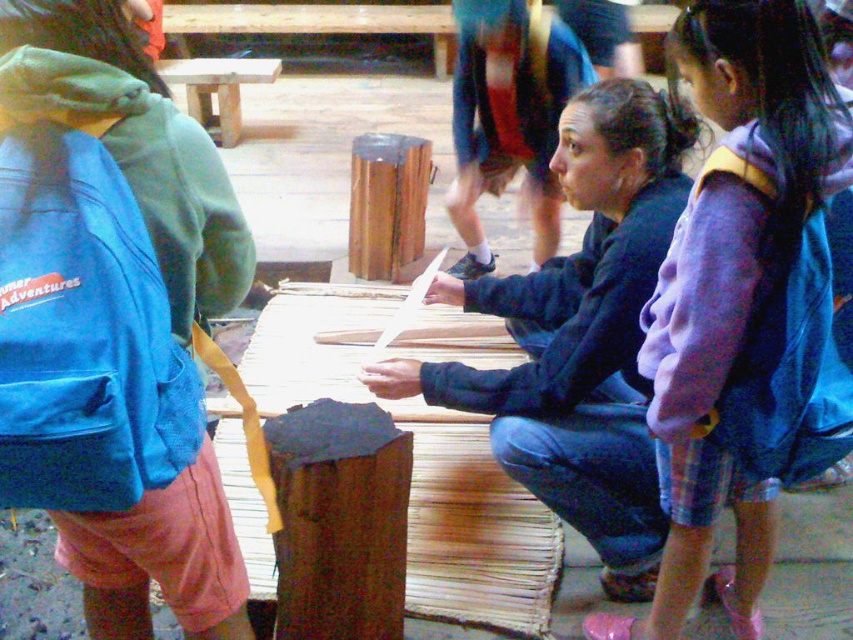
Question: Is blue fleece jacket at left wider than dark brown wood at center?

Choices:
 (A) yes
 (B) no

Answer: (A)

Question: Estimate the real-world distances between objects in this image. Which object is farther from the purple fleece jacket at center?

Choices:
 (A) smooth brown wood at center
 (B) blue fleece jacket at left
 (C) woodenmaterial/texture at center
 (D) dark blue fleece jacket at center

Answer: (A)

Question: Which object is positioned closest to the dark blue fleece jacket at center?

Choices:
 (A) smooth brown wood at center
 (B) blue fleece jacket at left
 (C) woodenmaterial/texture at center

Answer: (C)

Question: Based on their relative distances, which object is farther from the woodenmaterial/texture at center?

Choices:
 (A) purple fleece jacket at center
 (B) smooth brown wood at center
 (C) blue fleece jacket at left

Answer: (C)

Question: Is woodenmaterial/texture at center to the right of purple fleece jacket at upper right from the viewer's perspective?

Choices:
 (A) no
 (B) yes

Answer: (A)

Question: Observing the image, what is the correct spatial positioning of smooth wooden stool at center in reference to dark blue fleece jacket at center?

Choices:
 (A) above
 (B) below

Answer: (B)